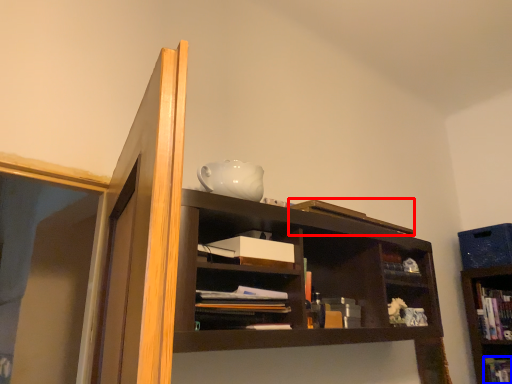
Question: Among these objects, which one is farthest to the camera, book (highlighted by a red box) or book (highlighted by a blue box)?

Choices:
 (A) book
 (B) book

Answer: (B)